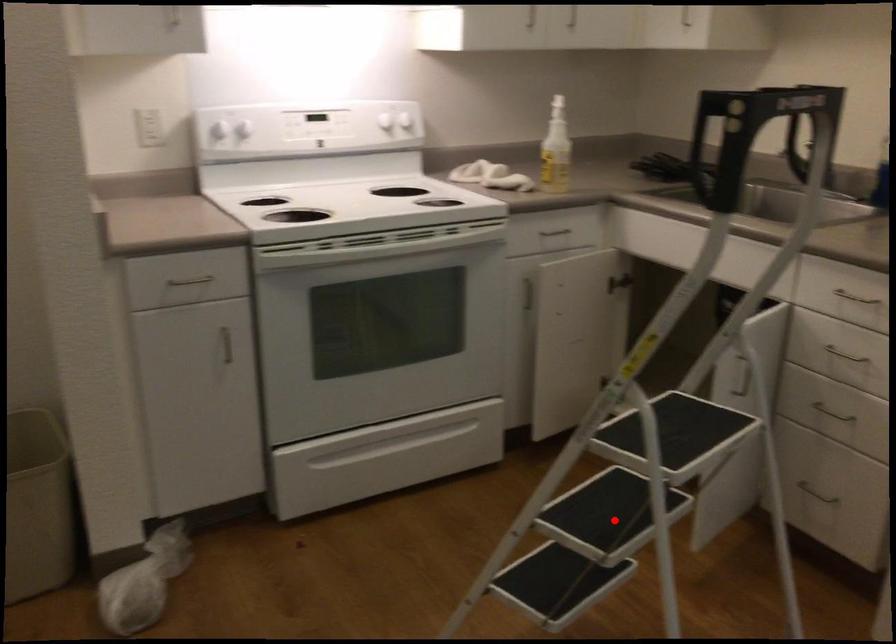
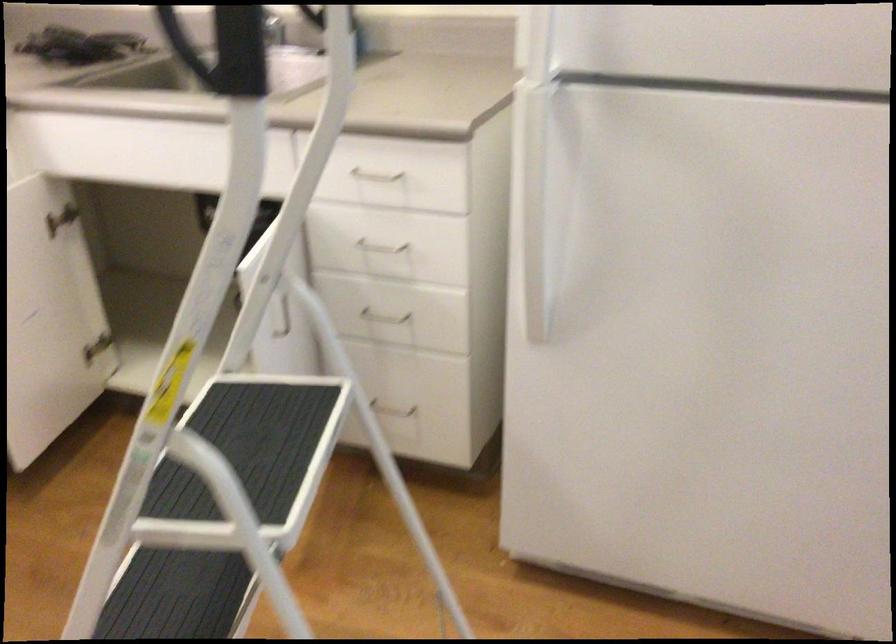
Question: I am providing you with two images of the same scene from different viewpoints. Given a red point in image1, look at the same physical point in image2. Is it:

Choices:
 (A) Closer to the viewpoint
 (B) Farther from the viewpoint

Answer: (A)